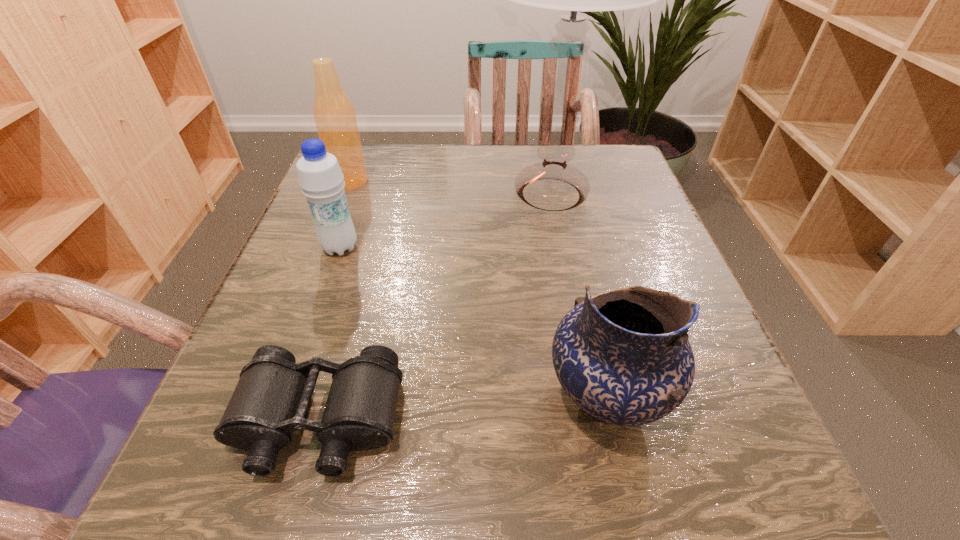
The image size is (960, 540). I want to click on beer bottle that is at the far edge, so click(x=334, y=115).

You are a GUI agent. You are given a task and a screenshot of the screen. Output one action in this format:
    pyautogui.click(x=<x>, y=<y>)
    Task: Click on the pottery that is at the near edge
    
    Given the screenshot: What is the action you would take?
    pyautogui.click(x=623, y=356)

At what (x,y) coordinates should I click in order to perform the action: click on binoculars present at the near edge. Please return your answer as a coordinate pair (x, y). Image resolution: width=960 pixels, height=540 pixels. Looking at the image, I should click on (271, 399).

Locate an element on the screen. Image resolution: width=960 pixels, height=540 pixels. beer bottle present at the left edge is located at coordinates (334, 115).

You are a GUI agent. You are given a task and a screenshot of the screen. Output one action in this format:
    pyautogui.click(x=<x>, y=<y>)
    Task: Click on the water bottle at the left edge
    This screenshot has height=540, width=960.
    Given the screenshot: What is the action you would take?
    pyautogui.click(x=320, y=177)

Where is `binoculars that is at the left edge`? binoculars that is at the left edge is located at coordinates (271, 399).

Identify the location of table lamp that is positioned at the right edge. The height and width of the screenshot is (540, 960). (552, 185).

The width and height of the screenshot is (960, 540). I want to click on pottery located at the right edge, so click(x=623, y=356).

Find the location of a particular element. object present at the far left corner is located at coordinates (334, 115).

The image size is (960, 540). What are the coordinates of `object that is at the near left corner` in the screenshot? It's located at (271, 399).